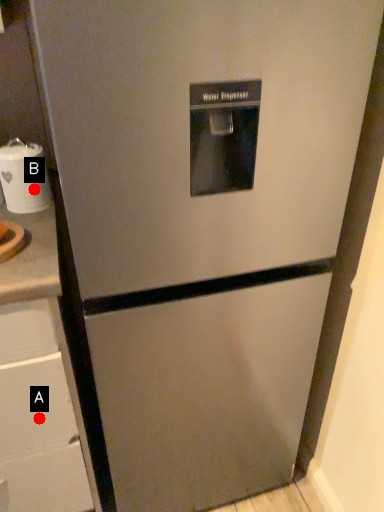
Question: Two points are circled on the image, labeled by A and B beside each circle. Which point is further to the camera?

Choices:
 (A) A is further
 (B) B is further

Answer: (B)